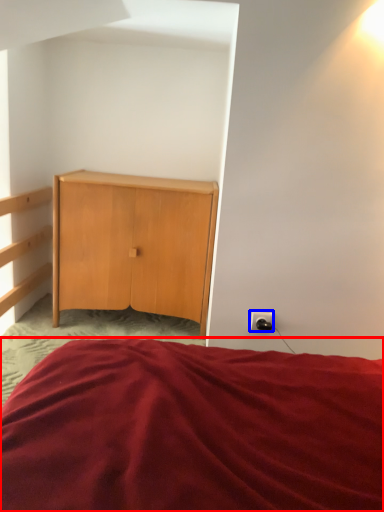
Question: Among these objects, which one is farthest to the camera, bed (highlighted by a red box) or electric outlet (highlighted by a blue box)?

Choices:
 (A) bed
 (B) electric outlet

Answer: (B)